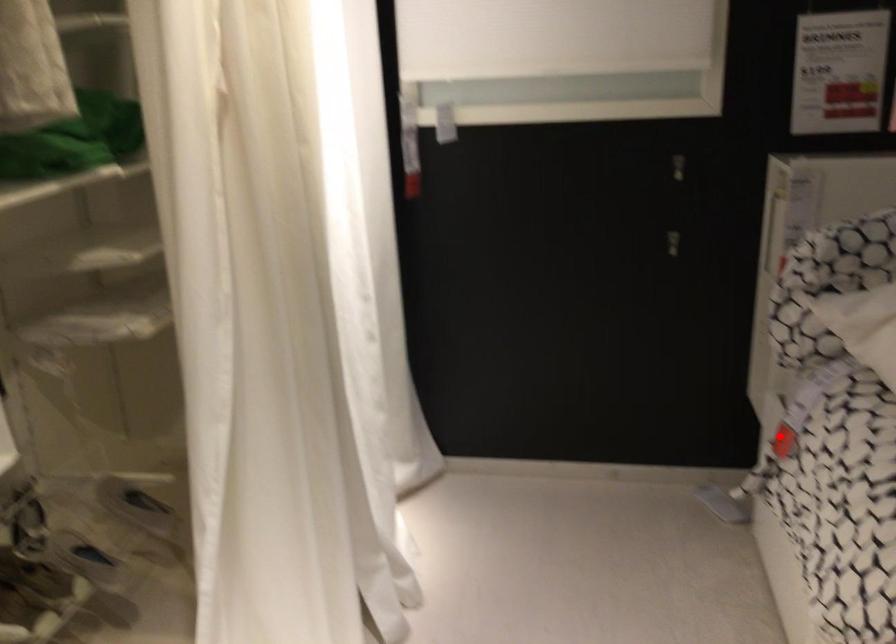
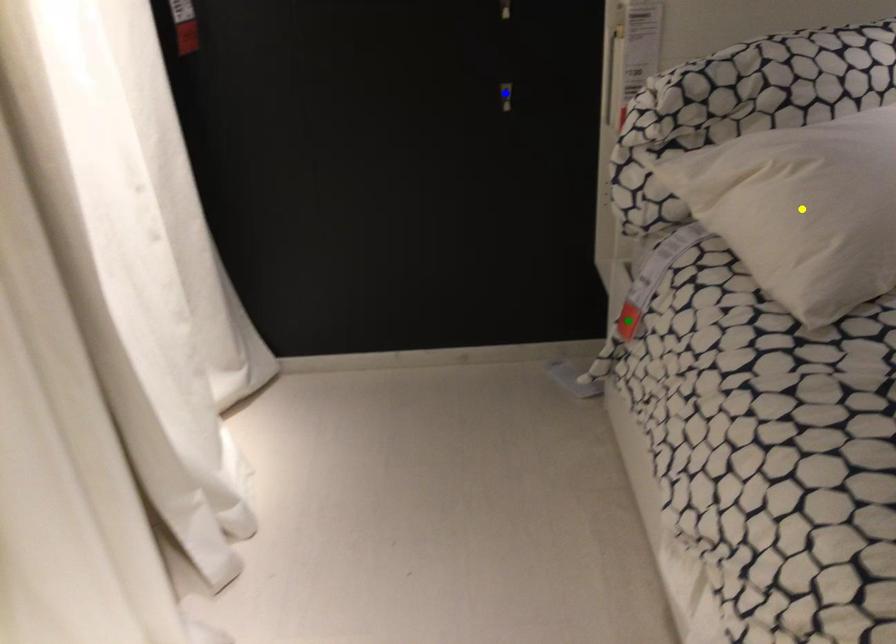
Question: I am providing you with two images of the same scene from different viewpoints. A red point is marked on the first image. You are given multiple points on the second image. Which mark in image 2 goes with the point in image 1?

Choices:
 (A) green point
 (B) yellow point
 (C) blue point

Answer: (A)